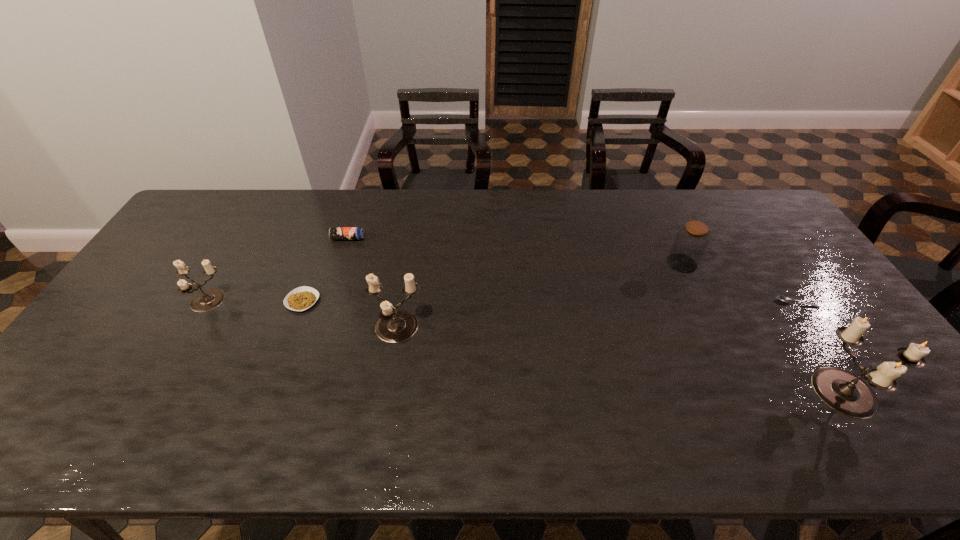
Identify the location of vacant region that satisfies the following two spatial constraints: 1. on the front side of the rightmost candle holder; 2. on the right side of the sixth tallest object. Image resolution: width=960 pixels, height=540 pixels. (268, 392).